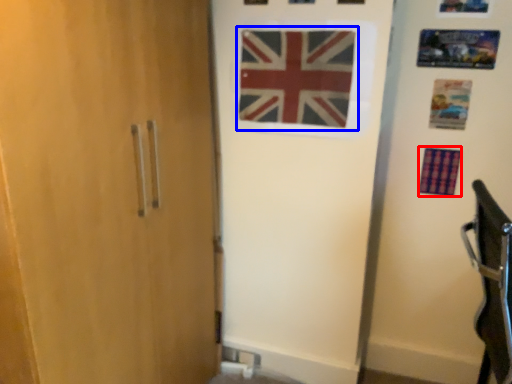
Question: Which point is closer to the camera, flag (highlighted by a red box) or flag (highlighted by a blue box)?

Choices:
 (A) flag
 (B) flag

Answer: (B)